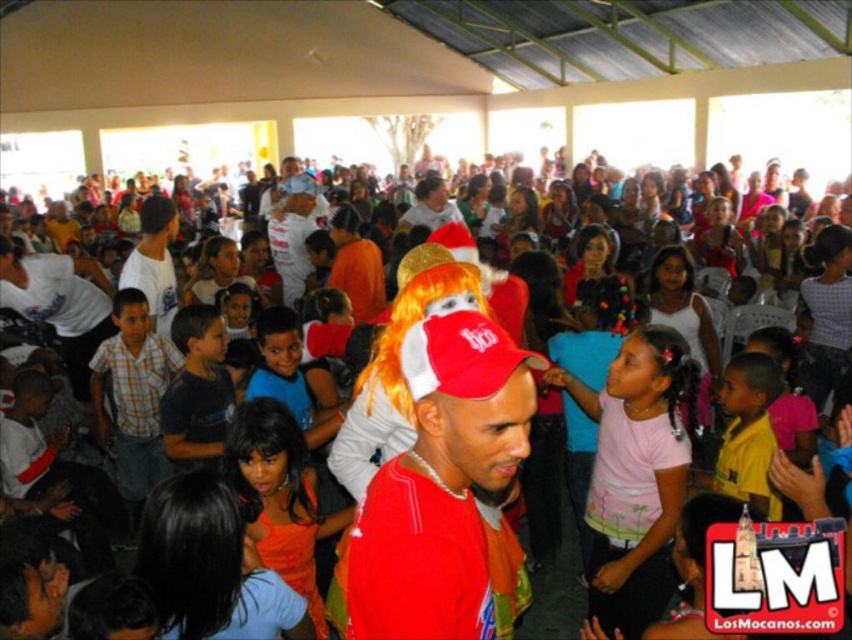
Question: Which point appears closest to the camera in this image?

Choices:
 (A) (223, 348)
 (B) (292, 182)
 (C) (744, 442)

Answer: (C)

Question: Which is nearer to the dark blue t-shirt at center?

Choices:
 (A) matte gold wig at center
 (B) yellow shirt at right
 (C) red matte cap at center
 (D) pink cotton shirt at center

Answer: (D)

Question: Is white cotton shirt at center in front of matte gold wig at center?

Choices:
 (A) yes
 (B) no

Answer: (A)

Question: Estimate the real-world distances between objects in this image. Which object is closer to the red matte cap at center?

Choices:
 (A) matte gold wig at center
 (B) white cotton shirt at center
 (C) pink cotton shirt at center
 (D) yellow shirt at right

Answer: (C)

Question: Does red matte cap at center have a larger size compared to dark blue t-shirt at center?

Choices:
 (A) no
 (B) yes

Answer: (B)

Question: Does yellow shirt at right appear on the left side of white cotton shirt at center?

Choices:
 (A) yes
 (B) no

Answer: (B)